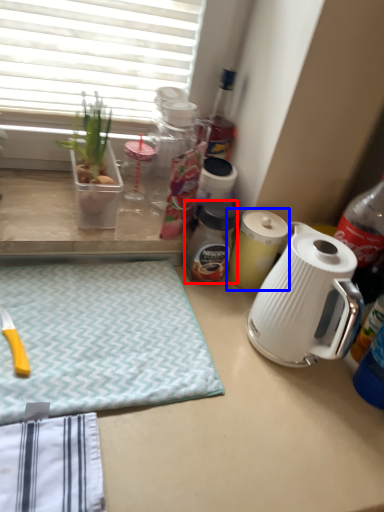
Question: Which of the following is the closest to the observer, bottle (highlighted by a red box) or kitchen appliance (highlighted by a blue box)?

Choices:
 (A) bottle
 (B) kitchen appliance

Answer: (A)